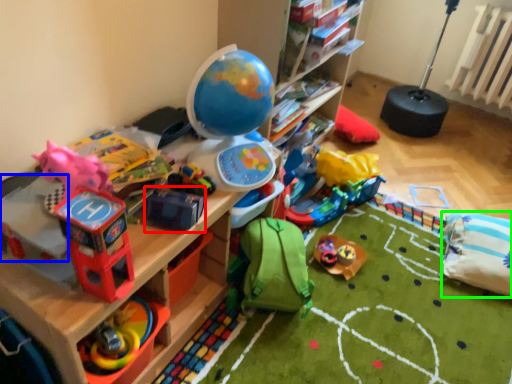
Question: Which is farther away from toy (highlighted by a red box)? toy (highlighted by a blue box) or pillow (highlighted by a green box)?

Choices:
 (A) toy
 (B) pillow

Answer: (B)